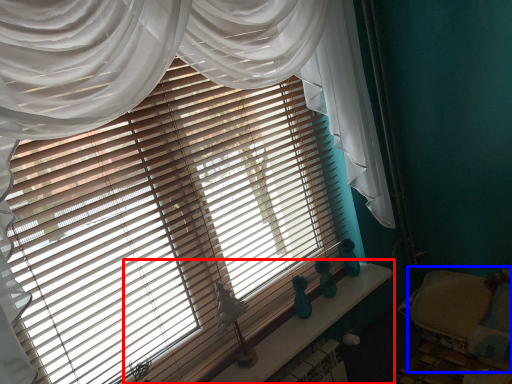
Question: Which object is closer to the camera taking this photo, window sill (highlighted by a red box) or bed (highlighted by a blue box)?

Choices:
 (A) window sill
 (B) bed

Answer: (A)